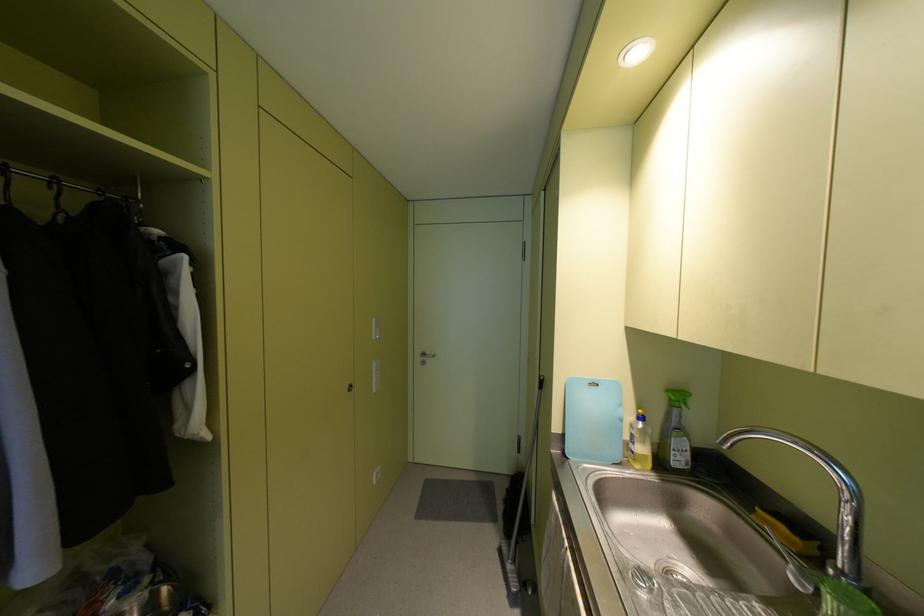
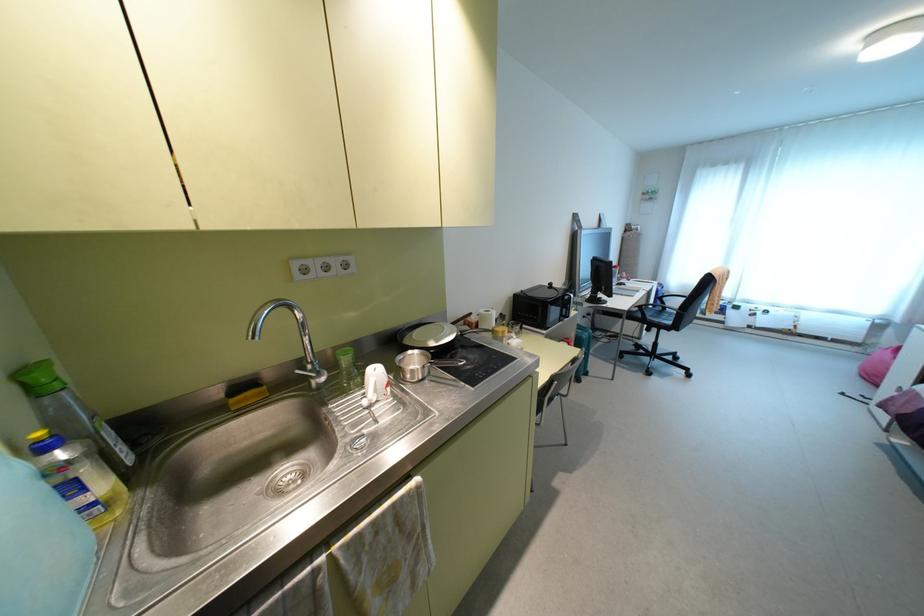
Locate, in the second image, the point that corresponds to point (666, 390) in the first image.

(20, 374)